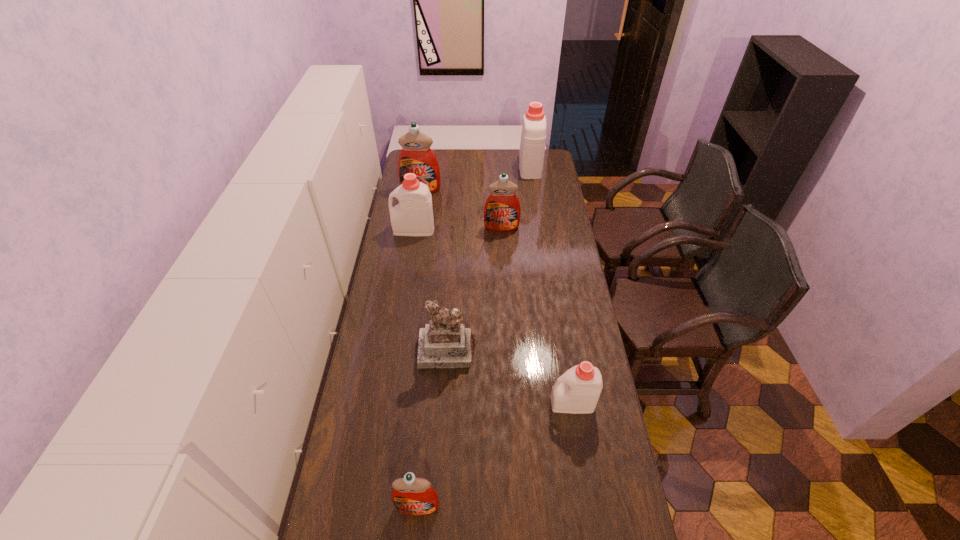
At what (x,y) coordinates should I click in order to perform the action: click on vacant space positioned 0.070m on the handle side of the sixth farthest object. Please return your answer as a coordinate pair (x, y). This screenshot has height=540, width=960. Looking at the image, I should click on (529, 403).

Identify the location of object that is at the far edge. (533, 136).

At what (x,y) coordinates should I click in order to perform the action: click on object positioned at the far right corner. Please return your answer as a coordinate pair (x, y). Looking at the image, I should click on (533, 136).

At what (x,y) coordinates should I click in order to perform the action: click on vacant space at the far edge. Please return your answer as a coordinate pair (x, y). The image size is (960, 540). Looking at the image, I should click on click(x=472, y=157).

Where is `free region at the left edge`? The image size is (960, 540). free region at the left edge is located at coordinates [x=355, y=460].

In order to click on free spot at the right edge of the desktop in this screenshot , I will do `click(551, 229)`.

The height and width of the screenshot is (540, 960). What are the coordinates of `free spot between the leftmost white detergent and the nearest white detergent` in the screenshot? It's located at (493, 316).

Locate an element on the screen. Image resolution: width=960 pixels, height=540 pixels. empty space that is in between the nearest object and the second biggest white detergent is located at coordinates (416, 368).

Locate an element on the screen. This screenshot has height=540, width=960. vacant point located between the leftmost white detergent and the third nearest object is located at coordinates (430, 291).

Image resolution: width=960 pixels, height=540 pixels. I want to click on free spot between the figurine and the biggest white detergent, so click(489, 259).